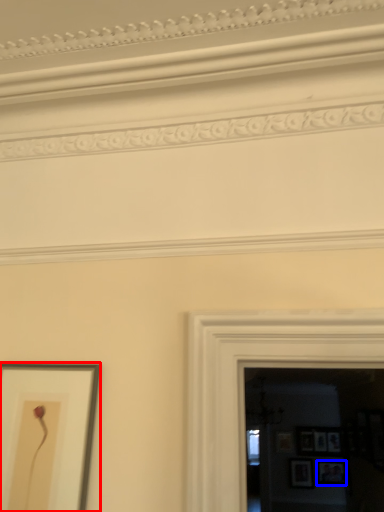
Question: Which object appears closest to the camera in this image, picture frame (highlighted by a red box) or picture frame (highlighted by a blue box)?

Choices:
 (A) picture frame
 (B) picture frame

Answer: (A)